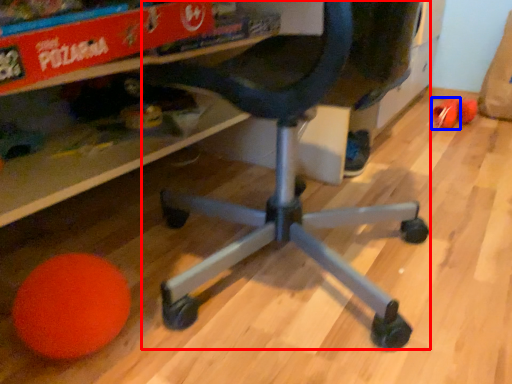
Question: Which point is further to the camera, computer chair (highlighted by a red box) or toy (highlighted by a blue box)?

Choices:
 (A) computer chair
 (B) toy

Answer: (B)